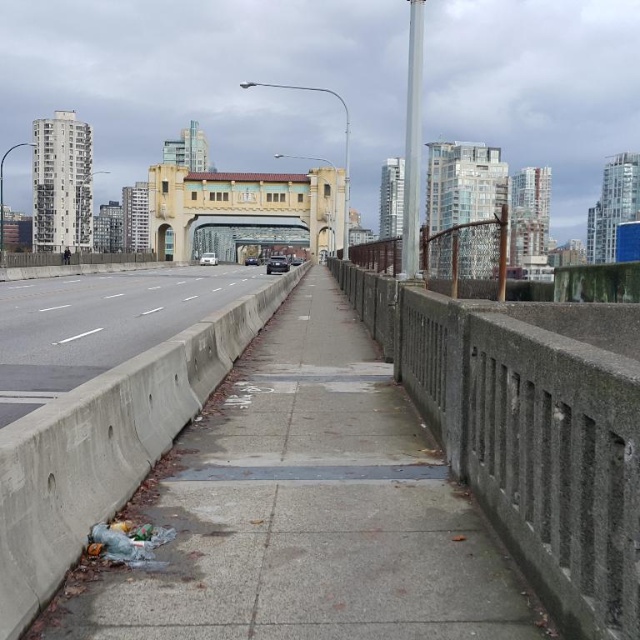
You are a delivery robot positioned at the start of the bridge. Your destination is the gray concrete pavement at center. According to the map, where should you head to reach it?

The gray concrete pavement at center is located at point (305, 512), so you should head towards that coordinate to reach it.

You are a delivery person trying to navigate a bridge. You need to determine the safest path to avoid tripping. Given the gray concrete pavement at center and the concrete at center, which surface should you choose based on their height?

The gray concrete pavement at center has a lesser height compared to the concrete at center, so choosing the gray concrete pavement at center would be safer as it is lower and less likely to cause tripping.